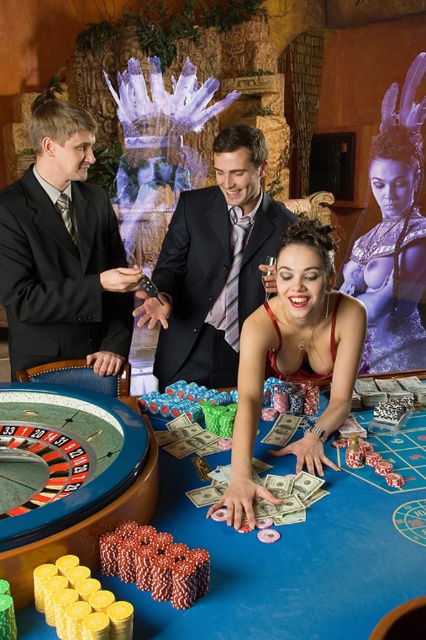
Question: Which object is closer to the camera taking this photo?

Choices:
 (A) matte red dress at center
 (B) blue felt table at center
 (C) black suit at center
 (D) shiny black suit at center

Answer: (B)

Question: Is black suit at center closer to camera compared to shiny black suit at center?

Choices:
 (A) yes
 (B) no

Answer: (B)

Question: Estimate the real-world distances between objects in this image. Which object is farther from the matte red dress at center?

Choices:
 (A) shiny black suit at center
 (B) black suit at center
 (C) blue felt table at center

Answer: (B)

Question: Is the position of black suit at center more distant than that of matte red dress at center?

Choices:
 (A) yes
 (B) no

Answer: (A)

Question: Can you confirm if black suit at center is wider than matte red dress at center?

Choices:
 (A) no
 (B) yes

Answer: (B)

Question: Which object appears closest to the camera in this image?

Choices:
 (A) blue felt table at center
 (B) black suit at center

Answer: (A)